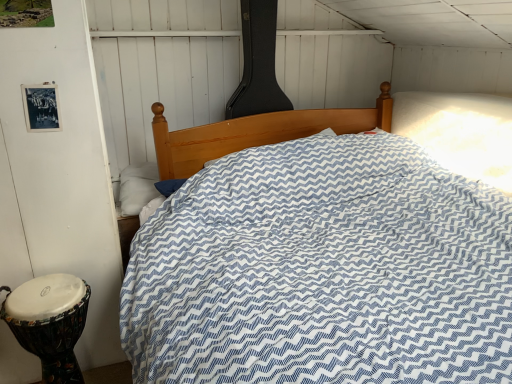
Question: In terms of size, does white leather drum at lower left appear bigger or smaller than white soft pillow at left?

Choices:
 (A) big
 (B) small

Answer: (A)

Question: Considering the relative positions of white leather drum at lower left and white soft pillow at left in the image provided, is white leather drum at lower left to the left or to the right of white soft pillow at left?

Choices:
 (A) right
 (B) left

Answer: (B)

Question: Considering the positions of white leather drum at lower left and white soft pillow at left in the image, is white leather drum at lower left taller or shorter than white soft pillow at left?

Choices:
 (A) tall
 (B) short

Answer: (A)

Question: Is point (123, 213) positioned closer to the camera than point (20, 329)?

Choices:
 (A) farther
 (B) closer

Answer: (A)

Question: From the image's perspective, is white soft pillow at left above or below white leather drum at lower left?

Choices:
 (A) above
 (B) below

Answer: (A)

Question: From a real-world perspective, relative to white leather drum at lower left, is white soft pillow at left vertically above or below?

Choices:
 (A) above
 (B) below

Answer: (A)

Question: Considering the positions of white soft pillow at left and white leather drum at lower left in the image, is white soft pillow at left taller or shorter than white leather drum at lower left?

Choices:
 (A) tall
 (B) short

Answer: (B)